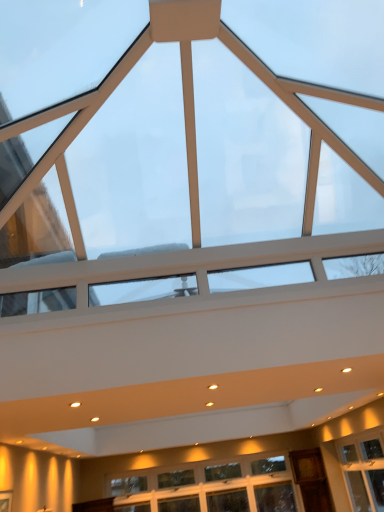
Question: In terms of width, does transparent glass window at center, acting as the second window starting from the bottom, look wider or thinner when compared to clear glass window at lower center, the 1th window when ordered from back to front?

Choices:
 (A) thin
 (B) wide

Answer: (B)

Question: From a real-world perspective, is transparent glass window at center, acting as the second window starting from the bottom, above or below clear glass window at lower center, the 2th window in the top-to-bottom sequence?

Choices:
 (A) above
 (B) below

Answer: (A)

Question: From the image's perspective, is transparent glass window at center, acting as the second window starting from the bottom, located above or below clear glass window at lower center, the 2th window in the top-to-bottom sequence?

Choices:
 (A) above
 (B) below

Answer: (A)

Question: Does point (182, 468) appear closer or farther from the camera than point (264, 8)?

Choices:
 (A) closer
 (B) farther

Answer: (B)

Question: From the image's perspective, is clear glass window at lower center, arranged as the 2th window when viewed from the front, above or below transparent glass window at center, the 1th window viewed from the front?

Choices:
 (A) below
 (B) above

Answer: (A)

Question: In terms of height, does clear glass window at lower center, the 1th window when ordered from back to front, look taller or shorter compared to transparent glass window at center, placed as the 1th window when sorted from top to bottom?

Choices:
 (A) tall
 (B) short

Answer: (B)

Question: Considering their positions, is clear glass window at lower center, the 1th window when ordered from back to front, located in front of or behind transparent glass window at center, placed as the 1th window when sorted from top to bottom?

Choices:
 (A) front
 (B) behind

Answer: (B)